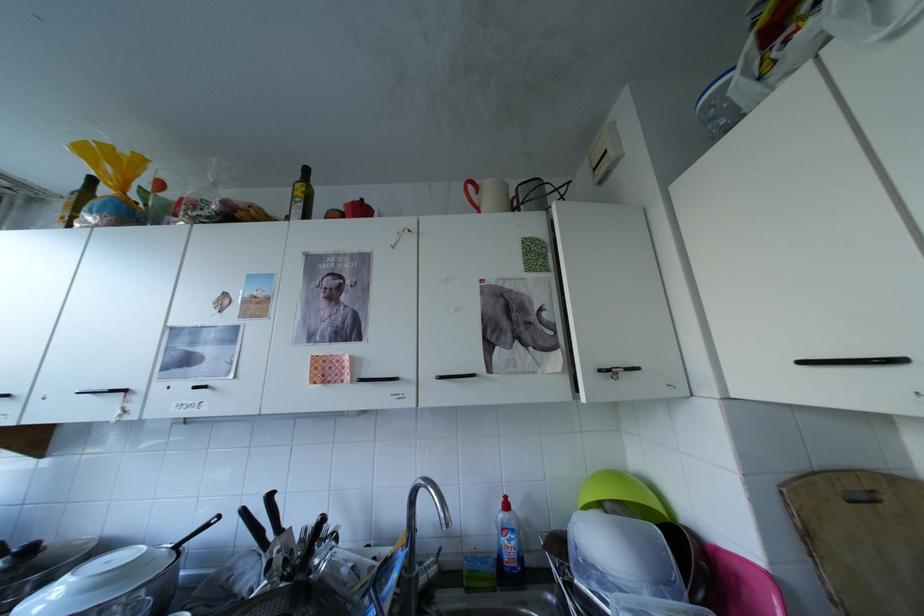
Find the location of `silver cabinet handle`. silver cabinet handle is located at coordinates (103, 391).